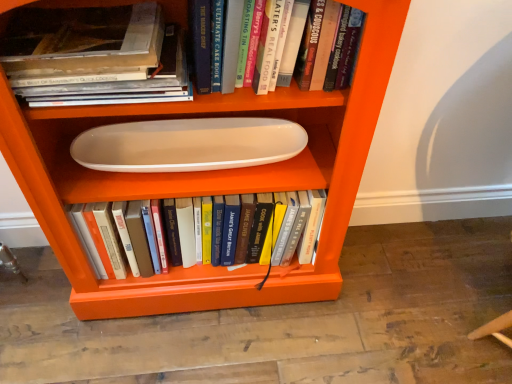
Describe the element at coordinates (117, 82) in the screenshot. I see `matte white book at upper left, arranged as the 2th book when viewed from the back` at that location.

Image resolution: width=512 pixels, height=384 pixels. What do you see at coordinates (248, 227) in the screenshot? I see `white matte oval plate at center, marked as the 3th book in a front-to-back arrangement` at bounding box center [248, 227].

Locate an element on the screen. white glossy oval tray at center is located at coordinates (209, 180).

How distant is matte white book at upper left, which is counted as the 2th book, starting from the front, from white matte oval plate at center, marked as the 3th book in a front-to-back arrangement?

15.65 inches.

Based on the photo, how different are the orientations of matte white book at upper left, which is counted as the 2th book, starting from the front, and white matte oval plate at center, the first book when ordered from back to front, in degrees?

matte white book at upper left, which is counted as the 2th book, starting from the front, and white matte oval plate at center, the first book when ordered from back to front, are facing 2.42e-05 degrees away from each other.

From the image's perspective, is matte white book at upper left, which is counted as the 2th book, starting from the front, on top of white matte oval plate at center, marked as the 3th book in a front-to-back arrangement?

Yes, from the image's perspective, matte white book at upper left, which is counted as the 2th book, starting from the front, is on top of white matte oval plate at center, marked as the 3th book in a front-to-back arrangement.

Considering the positions of points (135, 74) and (269, 246), is point (135, 74) closer to camera compared to point (269, 246)?

Yes, it is in front of point (269, 246).

Is white glossy oval tray at center with white matte oval plate at center, the first book when ordered from back to front?

No.

Based on the photo, could you tell me if white glossy oval tray at center is turned towards white matte oval plate at center, the first book when ordered from back to front?

Yes, white glossy oval tray at center is aimed at white matte oval plate at center, the first book when ordered from back to front.

The image size is (512, 384). What are the coordinates of `shelf on the right of white matte oval plate at center, the first book when ordered from back to front` in the screenshot? It's located at (209, 180).

How distant is white glossy oval tray at center from white matte oval plate at center, marked as the 3th book in a front-to-back arrangement?

white glossy oval tray at center and white matte oval plate at center, marked as the 3th book in a front-to-back arrangement, are 11.52 centimeters apart.

From the image's perspective, is white matte oval plate at center, the first book when ordered from back to front, under white glossy oval tray at center?

Indeed, from the image's perspective, white matte oval plate at center, the first book when ordered from back to front, is shown beneath white glossy oval tray at center.

Measure the distance between white matte oval plate at center, the first book when ordered from back to front, and white glossy oval tray at center.

white matte oval plate at center, the first book when ordered from back to front, and white glossy oval tray at center are 11.52 centimeters apart.

Is white matte oval plate at center, the first book when ordered from back to front, positioned with its back to white glossy oval tray at center?

Yes, white glossy oval tray at center is at the back of white matte oval plate at center, the first book when ordered from back to front.

Considering the relative sizes of white matte oval plate at center, marked as the 3th book in a front-to-back arrangement, and white glossy oval tray at center in the image provided, is white matte oval plate at center, marked as the 3th book in a front-to-back arrangement, wider than white glossy oval tray at center?

In fact, white matte oval plate at center, marked as the 3th book in a front-to-back arrangement, might be narrower than white glossy oval tray at center.

Would you say white glossy oval tray at center is to the left or to the right of hardcover book at upper center, which ranks as the third book in back-to-front order, in the picture?

white glossy oval tray at center is to the left of hardcover book at upper center, which ranks as the third book in back-to-front order.

What's the angular difference between white glossy oval tray at center and hardcover book at upper center, which ranks as the third book in back-to-front order,'s facing directions?

The angular difference between white glossy oval tray at center and hardcover book at upper center, which ranks as the third book in back-to-front order, is 4.59e-05 degrees.

Looking at this image, which of these two, white glossy oval tray at center or hardcover book at upper center, which ranks as the third book in back-to-front order, is bigger?

white glossy oval tray at center is bigger.

Between point (364, 68) and point (200, 2), which one is positioned in front?

The point (200, 2) is more forward.

Considering the sizes of white glossy oval tray at center and white glossy oval plate at center in the image, is white glossy oval tray at center taller or shorter than white glossy oval plate at center?

white glossy oval tray at center is taller than white glossy oval plate at center.

Can you confirm if white glossy oval tray at center is positioned to the left of white glossy oval plate at center?

No.

Looking at this image, can you confirm if white glossy oval tray at center is smaller than white glossy oval plate at center?

No.

Which is in front, white glossy oval tray at center or matte white book at upper left, which is counted as the 2th book, starting from the front?

white glossy oval tray at center is closer to the camera.

Is white glossy oval tray at center thinner than matte white book at upper left, arranged as the 2th book when viewed from the back?

In fact, white glossy oval tray at center might be wider than matte white book at upper left, arranged as the 2th book when viewed from the back.

Does white glossy oval tray at center contain matte white book at upper left, which is counted as the 2th book, starting from the front?

Yes, white glossy oval tray at center contains matte white book at upper left, which is counted as the 2th book, starting from the front.

Which object is positioned more to the left, white glossy oval tray at center or matte white book at upper left, which is counted as the 2th book, starting from the front?

matte white book at upper left, which is counted as the 2th book, starting from the front, is more to the left.

Does point (232, 36) come behind point (98, 154)?

No, it is not.

In the scene shown: Could you tell me if hardcover book at upper center, the first book positioned from the front, is facing white glossy oval plate at center?

No.

Image resolution: width=512 pixels, height=384 pixels. Identify the location of book that is the 2nd object to the right of the white glossy oval plate at center, starting at the anchor. (201, 40).

Considering the sizes of objects hardcover book at upper center, which ranks as the third book in back-to-front order, and white glossy oval plate at center in the image provided, who is shorter, hardcover book at upper center, which ranks as the third book in back-to-front order, or white glossy oval plate at center?

white glossy oval plate at center is shorter.

At what (x,y) coordinates should I click in order to perform the action: click on the 1st book in front of the white matte oval plate at center, marked as the 3th book in a front-to-back arrangement. Please return your answer as a coordinate pair (x, y). Looking at the image, I should click on (117, 82).

This screenshot has height=384, width=512. Identify the location of shelf above the white matte oval plate at center, marked as the 3th book in a front-to-back arrangement (from the image's perspective). (209, 180).

Estimate the real-world distances between objects in this image. Which object is further from matte white book at upper left, which is counted as the 2th book, starting from the front, white glossy oval plate at center or white matte oval plate at center, marked as the 3th book in a front-to-back arrangement?

white matte oval plate at center, marked as the 3th book in a front-to-back arrangement.

Looking at the image, which one is located closer to hardcover book at upper center, the first book positioned from the front, white glossy oval plate at center or matte white book at upper left, arranged as the 2th book when viewed from the back?

Among the two, matte white book at upper left, arranged as the 2th book when viewed from the back, is located nearer to hardcover book at upper center, the first book positioned from the front.

Looking at the image, which one is located further to white matte oval plate at center, marked as the 3th book in a front-to-back arrangement, hardcover book at upper center, the first book positioned from the front, or matte white book at upper left, which is counted as the 2th book, starting from the front?

Based on the image, hardcover book at upper center, the first book positioned from the front, appears to be further to white matte oval plate at center, marked as the 3th book in a front-to-back arrangement.

Estimate the real-world distances between objects in this image. Which object is further from hardcover book at upper center, which ranks as the third book in back-to-front order, white glossy oval tray at center or white glossy oval plate at center?

white glossy oval tray at center is positioned further to the anchor hardcover book at upper center, which ranks as the third book in back-to-front order.

When comparing their distances from matte white book at upper left, arranged as the 2th book when viewed from the back, does white matte oval plate at center, the first book when ordered from back to front, or white glossy oval tray at center seem further?

white matte oval plate at center, the first book when ordered from back to front, lies further to matte white book at upper left, arranged as the 2th book when viewed from the back, than the other object.

Estimate the real-world distances between objects in this image. Which object is further from matte white book at upper left, which is counted as the 2th book, starting from the front, white glossy oval tray at center or hardcover book at upper center, which ranks as the third book in back-to-front order?

white glossy oval tray at center.

Looking at the image, which one is located closer to hardcover book at upper center, which ranks as the third book in back-to-front order, matte white book at upper left, which is counted as the 2th book, starting from the front, or white glossy oval plate at center?

The object closer to hardcover book at upper center, which ranks as the third book in back-to-front order, is matte white book at upper left, which is counted as the 2th book, starting from the front.

Based on the photo, which object lies further to the anchor point white matte oval plate at center, the first book when ordered from back to front, matte white book at upper left, arranged as the 2th book when viewed from the back, or hardcover book at upper center, the first book positioned from the front?

hardcover book at upper center, the first book positioned from the front.

Find the location of a particular element. The height and width of the screenshot is (384, 512). paper plate between matte white book at upper left, arranged as the 2th book when viewed from the back, and hardcover book at upper center, the first book positioned from the front, in the horizontal direction is located at coordinates (188, 144).

Find the location of a particular element. The height and width of the screenshot is (384, 512). paper plate between white glossy oval tray at center and white matte oval plate at center, marked as the 3th book in a front-to-back arrangement, from front to back is located at coordinates (188, 144).

Image resolution: width=512 pixels, height=384 pixels. I want to click on paper plate between hardcover book at upper center, which ranks as the third book in back-to-front order, and white matte oval plate at center, marked as the 3th book in a front-to-back arrangement, in the up-down direction, so (188, 144).

The width and height of the screenshot is (512, 384). In order to click on paper plate between matte white book at upper left, which is counted as the 2th book, starting from the front, and white matte oval plate at center, marked as the 3th book in a front-to-back arrangement, in the up-down direction in this screenshot , I will do `click(188, 144)`.